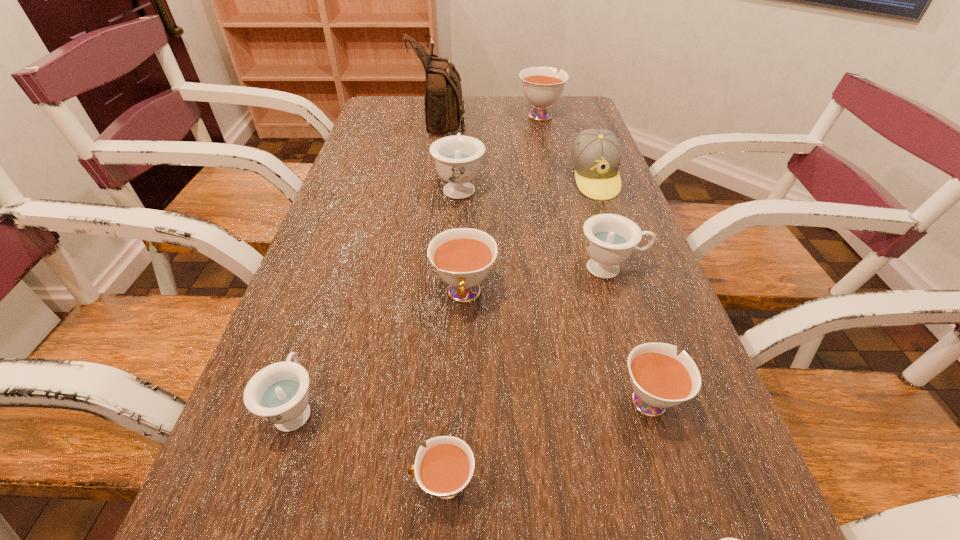
Identify the location of free area in between the second biggest blue teacup and the farthest teacup. (575, 191).

The image size is (960, 540). I want to click on vacant region between the nearest white teacup and the third farthest white teacup, so click(545, 441).

The height and width of the screenshot is (540, 960). Identify the location of empty space between the biggest blue teacup and the smallest white teacup. (451, 335).

Identify the location of free space between the third smallest white teacup and the farthest white teacup. The image size is (960, 540). (502, 204).

Point out which object is positioned as the seventh nearest to the smallest blue teacup. Please provide its 2D coordinates. Your answer should be formatted as a tuple, i.e. [(x, y)], where the tuple contains the x and y coordinates of a point satisfying the conditions above.

[(457, 158)]

Identify the location of the closest object to the third nearest blue teacup. (463, 257).

Identify which teacup is the fifth nearest to the smallest white teacup. Please provide its 2D coordinates. Your answer should be formatted as a tuple, i.e. [(x, y)], where the tuple contains the x and y coordinates of a point satisfying the conditions above.

[(610, 238)]

Locate an element on the screen. This screenshot has height=540, width=960. teacup that stands as the fifth closest to the second nearest object is located at coordinates (610, 238).

Identify the location of white teacup that is the second nearest to the third smallest white teacup. This screenshot has width=960, height=540. (446, 466).

Locate which white teacup ranks second in proximity to the second smallest blue teacup. Please provide its 2D coordinates. Your answer should be formatted as a tuple, i.e. [(x, y)], where the tuple contains the x and y coordinates of a point satisfying the conditions above.

[(463, 257)]